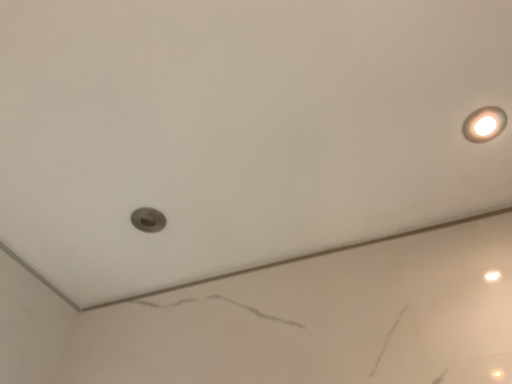
Question: Does matte white light fixture at upper right have a lesser height compared to matte gray hole at center-left?

Choices:
 (A) yes
 (B) no

Answer: (A)

Question: Can you confirm if matte white light fixture at upper right is taller than matte gray hole at center-left?

Choices:
 (A) no
 (B) yes

Answer: (A)

Question: Is matte white light fixture at upper right far from matte gray hole at center-left?

Choices:
 (A) yes
 (B) no

Answer: (B)

Question: From the image's perspective, is matte white light fixture at upper right above matte gray hole at center-left?

Choices:
 (A) no
 (B) yes

Answer: (B)

Question: Is matte white light fixture at upper right looking in the opposite direction of matte gray hole at center-left?

Choices:
 (A) no
 (B) yes

Answer: (A)

Question: Is matte white light fixture at upper right facing towards matte gray hole at center-left?

Choices:
 (A) yes
 (B) no

Answer: (B)

Question: From the image's perspective, does matte gray hole at center-left appear higher than matte white light fixture at upper right?

Choices:
 (A) yes
 (B) no

Answer: (B)

Question: Is matte gray hole at center-left looking in the opposite direction of matte white light fixture at upper right?

Choices:
 (A) yes
 (B) no

Answer: (B)

Question: Is matte gray hole at center-left outside matte white light fixture at upper right?

Choices:
 (A) yes
 (B) no

Answer: (A)

Question: Does matte gray hole at center-left come behind matte white light fixture at upper right?

Choices:
 (A) no
 (B) yes

Answer: (B)

Question: Does matte gray hole at center-left have a greater height compared to matte white light fixture at upper right?

Choices:
 (A) yes
 (B) no

Answer: (A)

Question: From the image's perspective, is matte gray hole at center-left under matte white light fixture at upper right?

Choices:
 (A) yes
 (B) no

Answer: (A)

Question: Visually, is matte gray hole at center-left positioned to the left or to the right of matte white light fixture at upper right?

Choices:
 (A) right
 (B) left

Answer: (B)